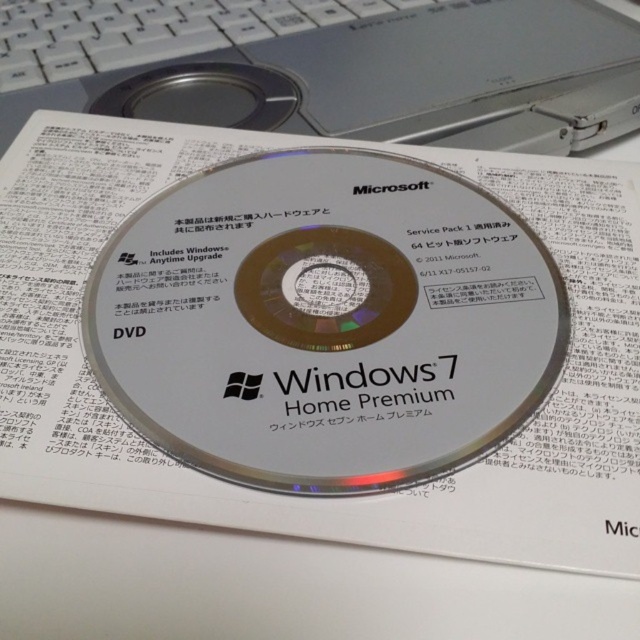
Consider the image. Which is more to the left, transparent plastic dvd at center or silver metallic laptop at center?

silver metallic laptop at center is more to the left.

Is point (474, 349) positioned behind point (164, 77)?

No, (474, 349) is closer to viewer.

Locate an element on the screen. transparent plastic dvd at center is located at coordinates [x=324, y=321].